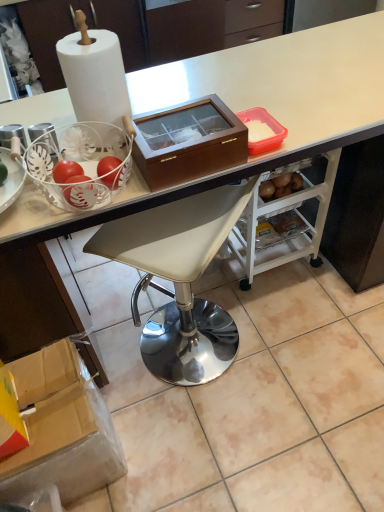
Question: Can brown wooden box at center, placed as the first box when sorted from right to left, be found inside white leather stool at center?

Choices:
 (A) yes
 (B) no

Answer: (B)

Question: From the image's perspective, is white leather stool at center on brown wooden box at center, acting as the 1th box starting from the top?

Choices:
 (A) yes
 (B) no

Answer: (B)

Question: Would you say white leather stool at center is outside brown wooden box at center, placed as the first box when sorted from right to left?

Choices:
 (A) no
 (B) yes

Answer: (B)

Question: Is white leather stool at center shorter than brown wooden box at center, placed as the first box when sorted from right to left?

Choices:
 (A) no
 (B) yes

Answer: (A)

Question: Is white leather stool at center in front of brown wooden box at center, placed as the first box when sorted from right to left?

Choices:
 (A) no
 (B) yes

Answer: (A)

Question: Is white leather stool at center situated inside brown wooden box at center, acting as the 1th box starting from the top, or outside?

Choices:
 (A) outside
 (B) inside

Answer: (A)

Question: Considering their positions, is white leather stool at center located in front of or behind brown wooden box at center, placed as the first box when sorted from right to left?

Choices:
 (A) behind
 (B) front

Answer: (A)

Question: Based on their sizes in the image, would you say white leather stool at center is bigger or smaller than brown wooden box at center, acting as the 1th box starting from the top?

Choices:
 (A) big
 (B) small

Answer: (A)

Question: Is white leather stool at center wider or thinner than brown wooden box at center, acting as the 1th box starting from the top?

Choices:
 (A) thin
 (B) wide

Answer: (B)

Question: From a real-world perspective, is brown wooden box at center, acting as the 1th box starting from the top, physically located above or below white leather stool at center?

Choices:
 (A) above
 (B) below

Answer: (A)

Question: Based on their positions, is brown wooden box at center, the 2th box ordered from the bottom, located to the left or right of white leather stool at center?

Choices:
 (A) left
 (B) right

Answer: (B)

Question: In terms of size, does brown wooden box at center, placed as the first box when sorted from right to left, appear bigger or smaller than white leather stool at center?

Choices:
 (A) big
 (B) small

Answer: (B)

Question: In terms of width, does brown wooden box at center, acting as the 1th box starting from the top, look wider or thinner when compared to white leather stool at center?

Choices:
 (A) thin
 (B) wide

Answer: (A)

Question: From their relative heights in the image, would you say cardboard box at lower left, the first box in the left-to-right sequence, is taller or shorter than brown wooden box at center, the 2th box ordered from the bottom?

Choices:
 (A) short
 (B) tall

Answer: (B)

Question: Is cardboard box at lower left, placed as the 1th box when sorted from bottom to top, situated inside brown wooden box at center, the 2th box ordered from the bottom, or outside?

Choices:
 (A) outside
 (B) inside

Answer: (A)